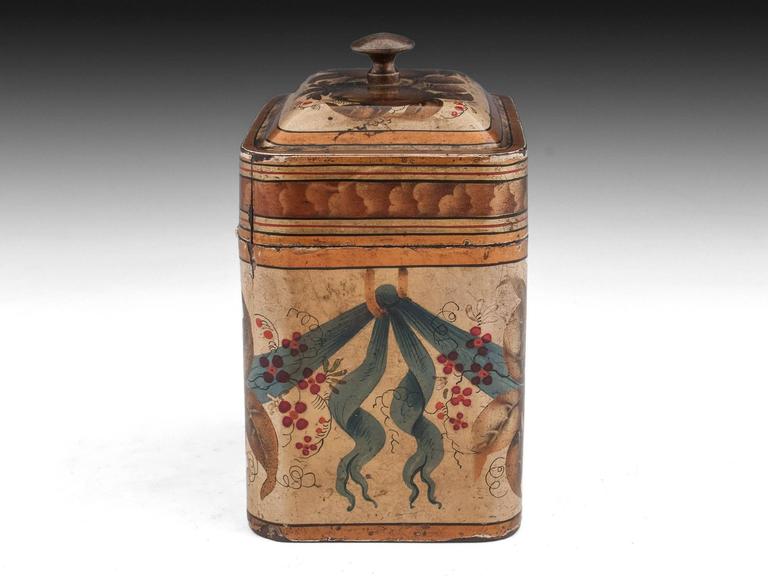
Identify the location of box. (428, 113).